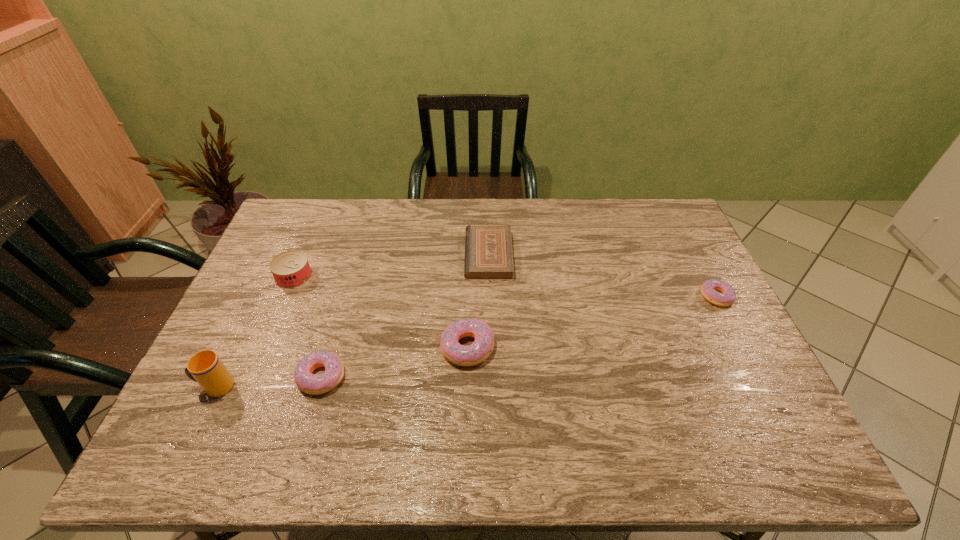
At what (x,y) coordinates should I click in order to perform the action: click on object positioned at the right edge. Please return your answer as a coordinate pair (x, y). This screenshot has height=540, width=960. Looking at the image, I should click on (728, 296).

Locate an element on the screen. Image resolution: width=960 pixels, height=540 pixels. object present at the near left corner is located at coordinates (205, 367).

In the image, there is a desktop. Where is `vacant region at the far edge`? vacant region at the far edge is located at coordinates (604, 213).

This screenshot has height=540, width=960. Find the location of `vacant area at the near edge of the desktop`. vacant area at the near edge of the desktop is located at coordinates (663, 413).

Locate an element on the screen. vacant region at the left edge of the desktop is located at coordinates (248, 374).

Image resolution: width=960 pixels, height=540 pixels. In order to click on vacant space at the right edge of the desktop in this screenshot , I will do pyautogui.click(x=683, y=330).

Where is `blank area at the far left corner`? The image size is (960, 540). blank area at the far left corner is located at coordinates (317, 220).

The width and height of the screenshot is (960, 540). I want to click on blank space at the far right corner of the desktop, so click(660, 238).

The image size is (960, 540). What are the coordinates of `unoccupied area between the can and the tallest object` in the screenshot? It's located at (254, 331).

Locate an element on the screen. The width and height of the screenshot is (960, 540). unoccupied position between the fourth object from right to left and the can is located at coordinates (308, 326).